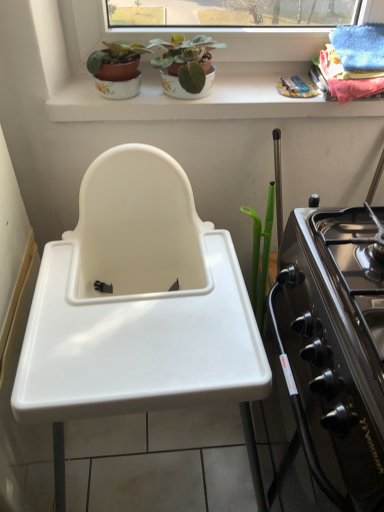
I want to click on vacant space to the left of matte ceramic pot at upper center, acting as the second houseplant starting from the right, so click(x=69, y=86).